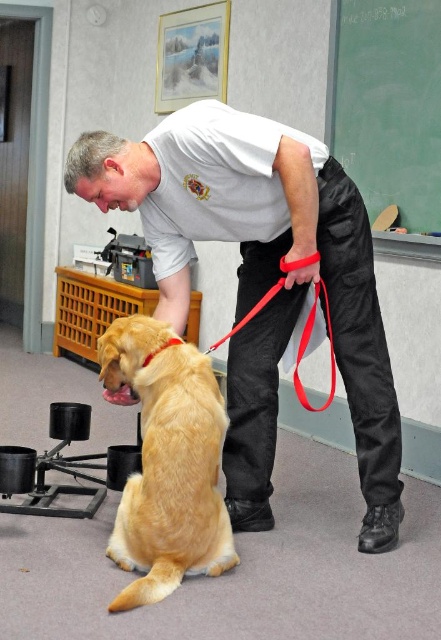
Who is taller, matte white shirt at center or red nylon leash at lower center?

matte white shirt at center is taller.

Between matte white shirt at center and red nylon leash at lower center, which one has less height?

red nylon leash at lower center is shorter.

Is point (254, 451) closer to camera compared to point (320, 280)?

No, it is not.

The image size is (441, 640). I want to click on matte white shirt at center, so click(261, 280).

Is matte white shirt at center below green chalkboard at upper right?

Yes.

Locate an element on the screen. matte white shirt at center is located at coordinates (261, 280).

Image resolution: width=441 pixels, height=640 pixels. In order to click on matte white shirt at center in this screenshot , I will do `click(261, 280)`.

Looking at this image, which is more to the left, golden fur dog at center or red nylon leash at lower center?

golden fur dog at center

Does golden fur dog at center have a lesser height compared to red nylon leash at lower center?

In fact, golden fur dog at center may be taller than red nylon leash at lower center.

Where is `golden fur dog at center`? golden fur dog at center is located at coordinates (168, 461).